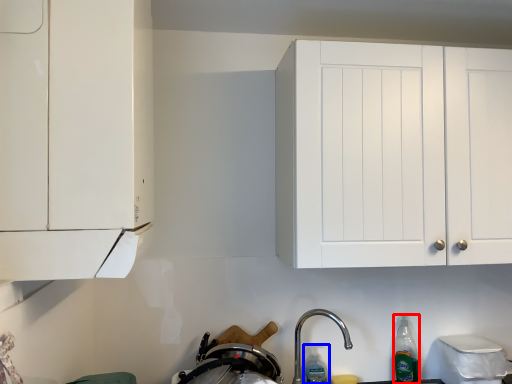
Question: Among these objects, which one is nearest to the camera, bottle (highlighted by a red box) or bottle (highlighted by a blue box)?

Choices:
 (A) bottle
 (B) bottle

Answer: (B)